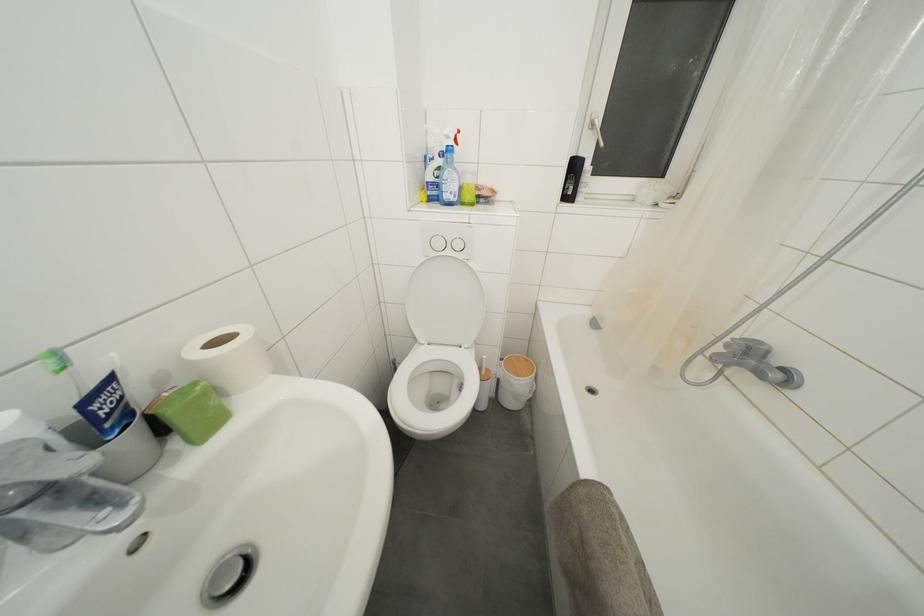
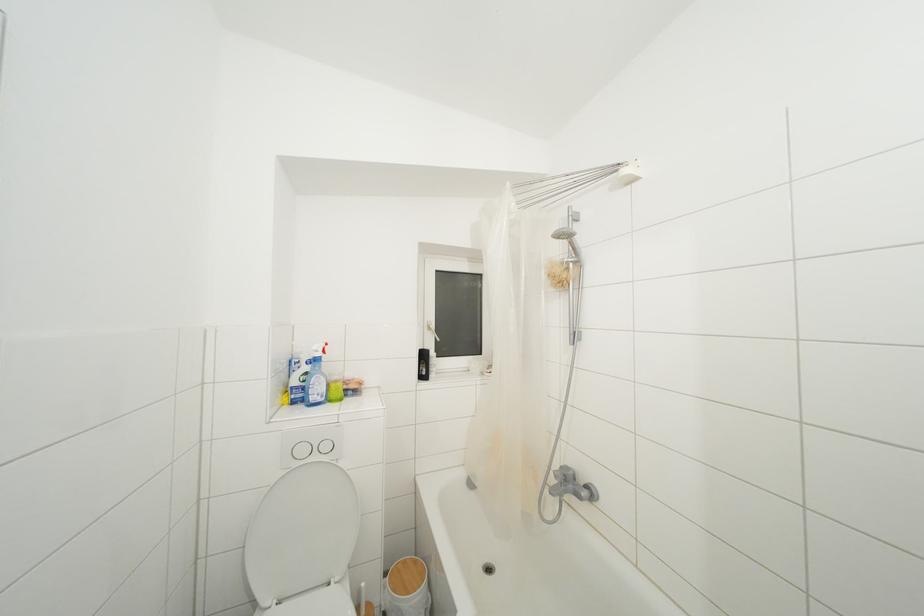
Find the pixel in the second image that matches point 752,353 in the first image.

(568, 480)